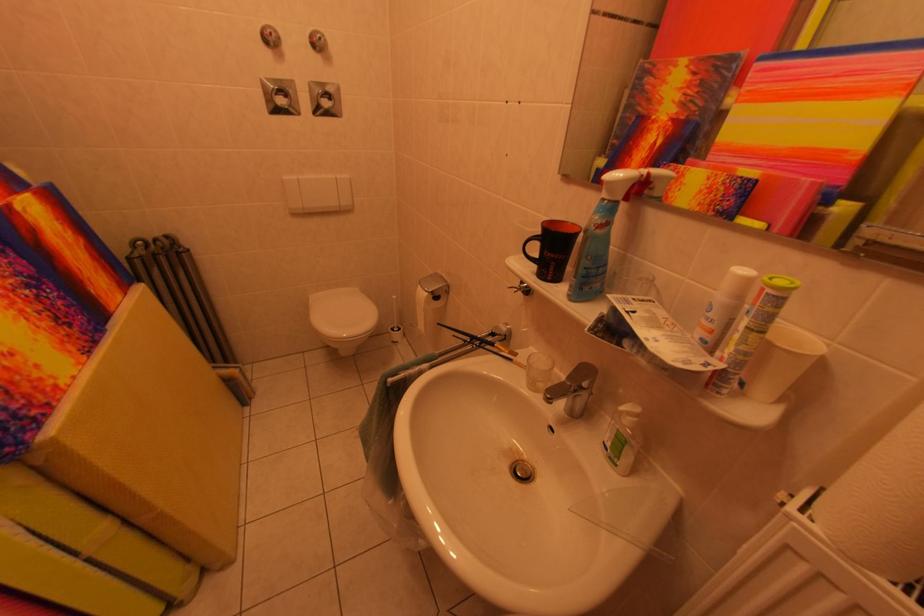
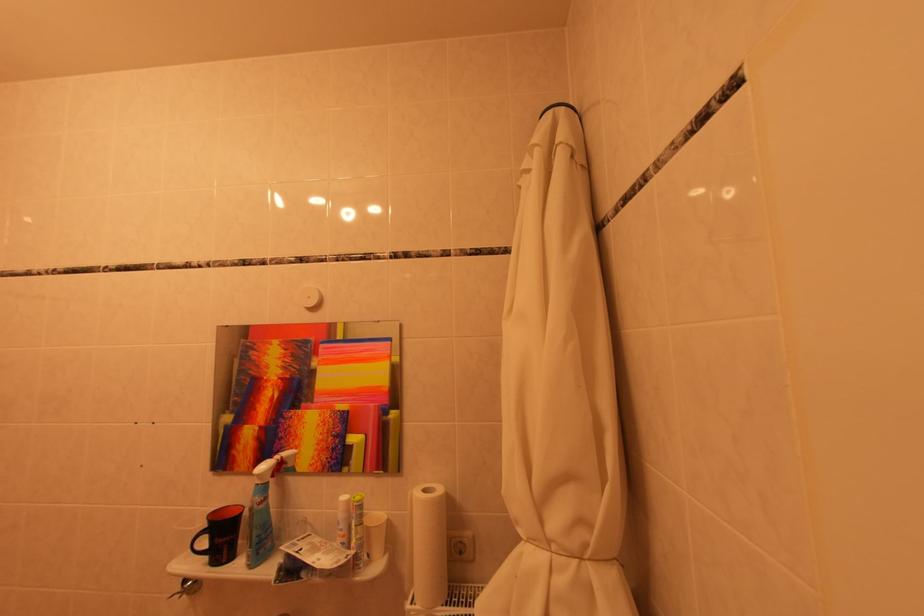
Where in the second image is the point corresponding to pixel 744 269 from the first image?

(349, 500)